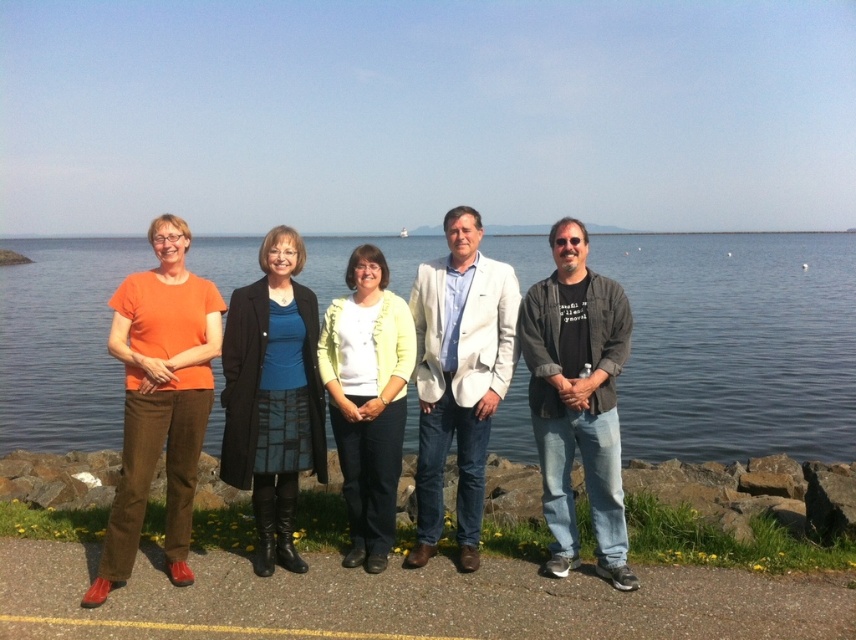
Is orange cotton shirt at left bigger than blue silk blouse at center?

Yes.

In order to click on orange cotton shirt at left in this screenshot , I will do `click(159, 400)`.

Does blue silk blouse at center have a lesser width compared to light yellow cardigan at center?

No, blue silk blouse at center is not thinner than light yellow cardigan at center.

Which of these two, blue silk blouse at center or light yellow cardigan at center, stands shorter?

light yellow cardigan at center

Who is more forward, (306, 420) or (379, 412)?

Point (379, 412) is in front.

The height and width of the screenshot is (640, 856). In order to click on blue silk blouse at center in this screenshot , I will do `click(272, 396)`.

Measure the distance between point (x=541, y=312) and camera.

5.45 meters

Does dark gray textured jacket at right come in front of light yellow cardigan at center?

Yes.

The height and width of the screenshot is (640, 856). What do you see at coordinates (577, 400) in the screenshot?
I see `dark gray textured jacket at right` at bounding box center [577, 400].

Identify the location of dark gray textured jacket at right. The width and height of the screenshot is (856, 640). (577, 400).